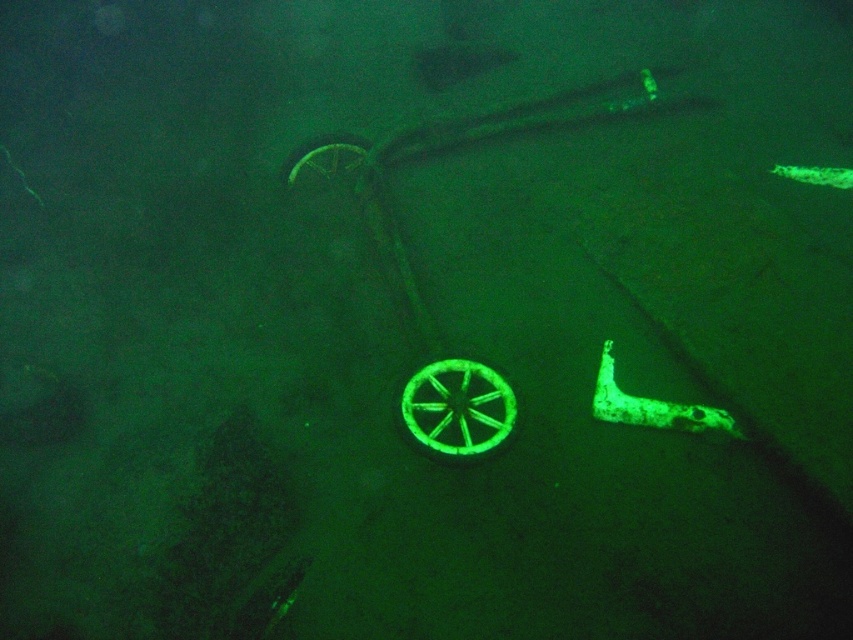
You are a marine archaeologist examining an underwater shipwreck site. You observe a point at coordinates (457,410) in your sonar scan. Based on the image description, what object does this point most likely represent?

The point at coordinates (457,410) corresponds to the green matte wheel at center.

You are a marine archaeologist examining an underwater shipwreck site. You notice a green matte wheel at center. Can you determine its exact position relative to the image frame using the coordinate system provided?

The green matte wheel at center is located at point (x=457, y=410) in the coordinate system.